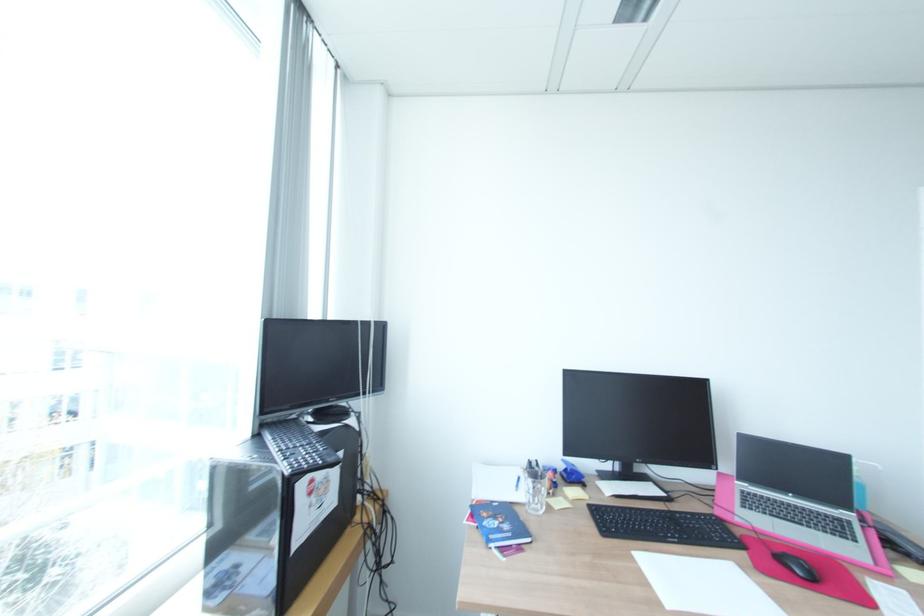
You are a GUI agent. You are given a task and a screenshot of the screen. Output one action in this format:
    pyautogui.click(x=<x>, y=<y>)
    Task: Click on the black computer mouse
    The image size is (924, 616).
    Given the screenshot: What is the action you would take?
    pyautogui.click(x=796, y=565)